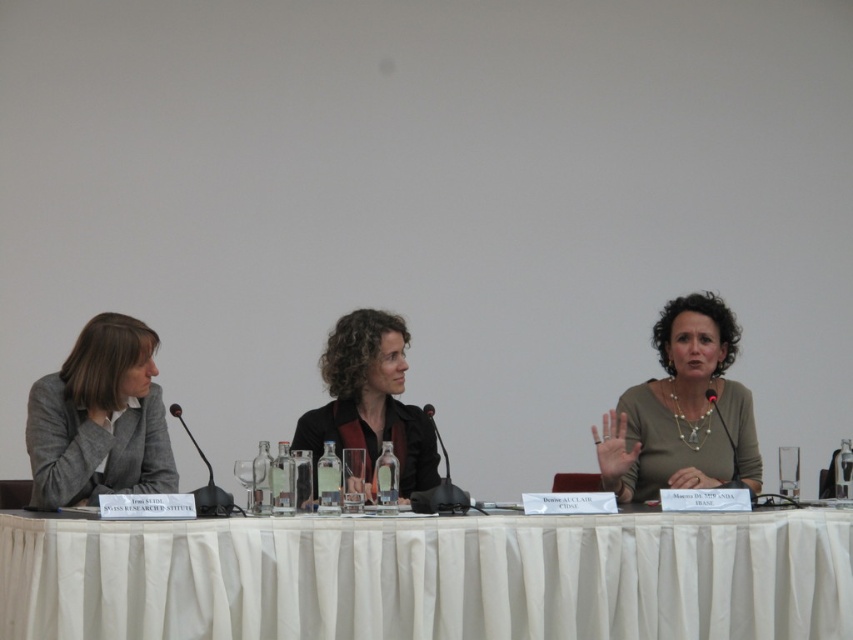
You are an event organizer setting up a conference room. You have two items to place on the table in the scene described. The white cloth at center and the gray woolen blazer at left. Based on their sizes, which item should you place on the table first to ensure proper positioning?

The white cloth at center has a lesser height compared to the gray woolen blazer at left. Therefore, you should place the gray woolen blazer at left first, as it is taller and would require positioning before the lower white cloth at center to avoid obstruction.

You are an event organizer checking the seating arrangement. You need to ensure that all nameplates are visible to the audience. Since the nameplates are placed in front of each participant, could the matte beige blouse at center or the black plastic microphone at center obstruct the view of the nameplate in front of them?

The matte beige blouse at center has a greater height compared to the black plastic microphone at center. Since the blouse is taller, it might block the nameplate from the audience view more than the microphone, so adjusting the blouse or nameplate position could help visibility.

You are a photographer standing at the center of the room, and you want to take a closeup shot of the gray woolen blazer at left. Which direction should you move to get closer to it?

The gray woolen blazer at left is located at point (x=99, y=419). Since you are at the center of the room, you should move to the left to get closer to it.